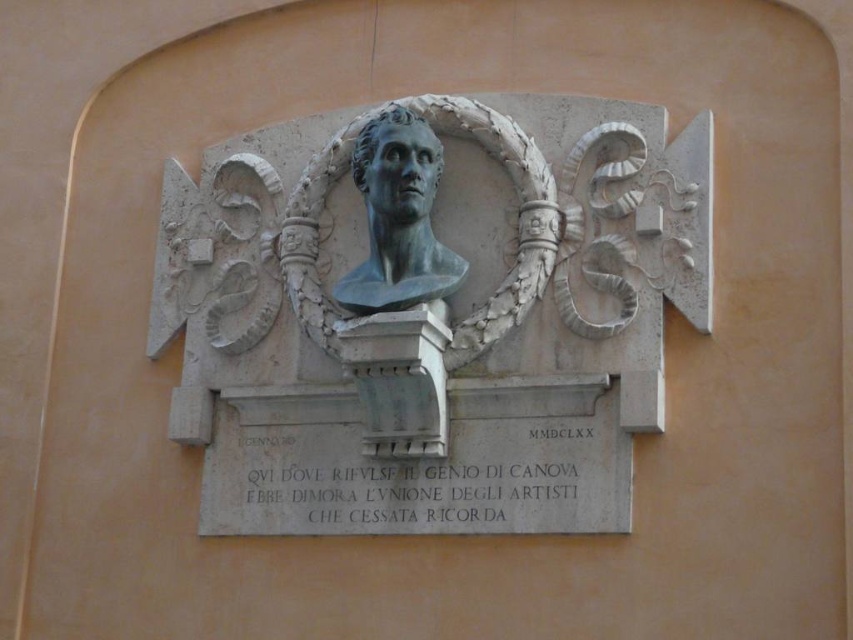
Question: Is white stone ornament at upper right in front of bronze bust at center?

Choices:
 (A) no
 (B) yes

Answer: (B)

Question: Among these objects, which one is farthest from the camera?

Choices:
 (A) white stone ornament at upper right
 (B) bronze bust at center
 (C) matte white bust at center

Answer: (B)

Question: Which of the following is the closest to the observer?

Choices:
 (A) black stone plaque at center
 (B) blue-green stone bust at center
 (C) white stone ornament at upper right

Answer: (A)

Question: Is white stone ornament at upper right in front of blue-green stone bust at center?

Choices:
 (A) no
 (B) yes

Answer: (A)

Question: Among these objects, which one is nearest to the camera?

Choices:
 (A) blue-green stone bust at center
 (B) matte white bust at center
 (C) white stone ornament at upper right

Answer: (B)

Question: Is the position of white stone ornament at upper right less distant than that of bronze bust at center?

Choices:
 (A) yes
 (B) no

Answer: (A)